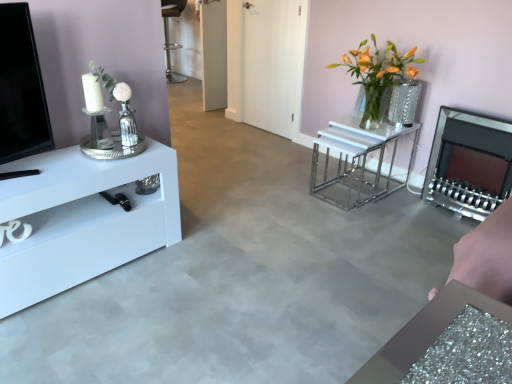
Question: Would you say translucent glass vase at center right is a long distance from matte black fireplace at right?

Choices:
 (A) yes
 (B) no

Answer: (B)

Question: From the image's perspective, is translucent glass vase at center right on matte black fireplace at right?

Choices:
 (A) no
 (B) yes

Answer: (B)

Question: Considering the relative sizes of translucent glass vase at center right and matte black fireplace at right in the image provided, is translucent glass vase at center right shorter than matte black fireplace at right?

Choices:
 (A) no
 (B) yes

Answer: (B)

Question: Considering the relative sizes of translucent glass vase at center right and matte black fireplace at right in the image provided, is translucent glass vase at center right taller than matte black fireplace at right?

Choices:
 (A) no
 (B) yes

Answer: (A)

Question: From a real-world perspective, does translucent glass vase at center right sit lower than matte black fireplace at right?

Choices:
 (A) yes
 (B) no

Answer: (B)

Question: Is translucent glass vase at center right wider than matte black fireplace at right?

Choices:
 (A) yes
 (B) no

Answer: (A)

Question: From a real-world perspective, is metallic silver stool at center under matte black fireplace at right?

Choices:
 (A) yes
 (B) no

Answer: (B)

Question: Is metallic silver stool at center outside of matte black fireplace at right?

Choices:
 (A) yes
 (B) no

Answer: (A)

Question: Is metallic silver stool at center wider than matte black fireplace at right?

Choices:
 (A) no
 (B) yes

Answer: (B)

Question: From the image's perspective, does metallic silver stool at center appear higher than matte black fireplace at right?

Choices:
 (A) no
 (B) yes

Answer: (B)

Question: Is metallic silver stool at center taller than matte black fireplace at right?

Choices:
 (A) yes
 (B) no

Answer: (A)

Question: Is the position of metallic silver stool at center less distant than that of matte black fireplace at right?

Choices:
 (A) no
 (B) yes

Answer: (A)

Question: From the image's perspective, is translucent glass vase at center right under white glossy nesting tables at center, arranged as the first table when viewed from the back?

Choices:
 (A) no
 (B) yes

Answer: (A)